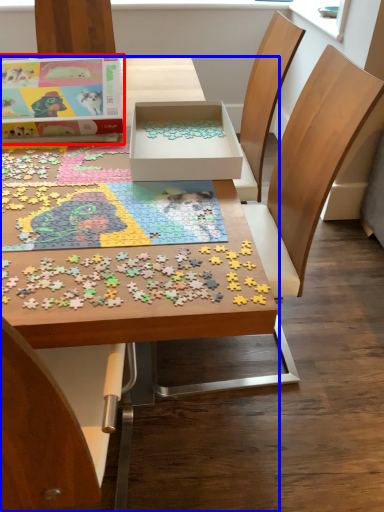
Question: Which object appears closest to the camera in this image, box (highlighted by a red box) or table (highlighted by a blue box)?

Choices:
 (A) box
 (B) table

Answer: (B)